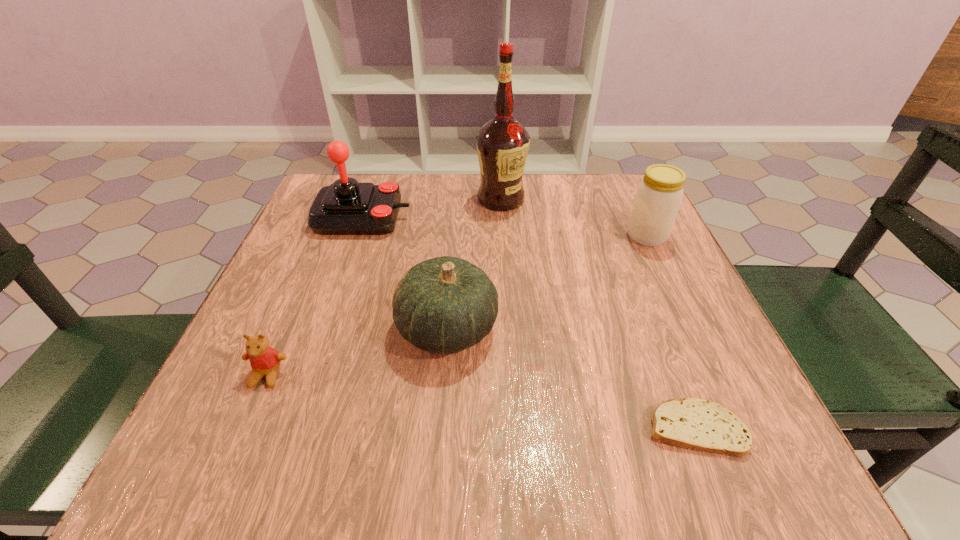
You are a GUI agent. You are given a task and a screenshot of the screen. Output one action in this format:
    pyautogui.click(x=<x>, y=<y>)
    Task: Click on the pita bread at the right edge
    
    Given the screenshot: What is the action you would take?
    pyautogui.click(x=693, y=423)

Identify the location of object at the far left corner. This screenshot has width=960, height=540. (346, 207).

The height and width of the screenshot is (540, 960). I want to click on object that is at the far right corner, so click(x=658, y=197).

Where is `object that is at the near right corner`? The image size is (960, 540). object that is at the near right corner is located at coordinates (693, 423).

Locate an element on the screen. free region at the far edge of the desktop is located at coordinates (559, 215).

This screenshot has width=960, height=540. Find the location of `free space at the near edge of the desktop`. free space at the near edge of the desktop is located at coordinates (482, 433).

In order to click on free space at the left edge of the desktop in this screenshot , I will do `click(350, 257)`.

This screenshot has width=960, height=540. Find the location of `vacant space at the right edge`. vacant space at the right edge is located at coordinates (684, 292).

In the image, there is a desktop. Where is `vacant space at the near left corner`? The width and height of the screenshot is (960, 540). vacant space at the near left corner is located at coordinates (197, 420).

This screenshot has height=540, width=960. In the image, there is a desktop. Identify the location of vacant space at the far right corner. (636, 185).